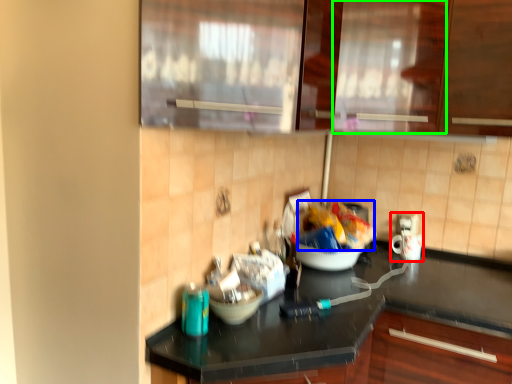
Question: Estimate the real-world distances between objects in this image. Which object is farther from appliance (highlighted by a red box), food (highlighted by a blue box) or glass door (highlighted by a green box)?

Choices:
 (A) food
 (B) glass door

Answer: (B)